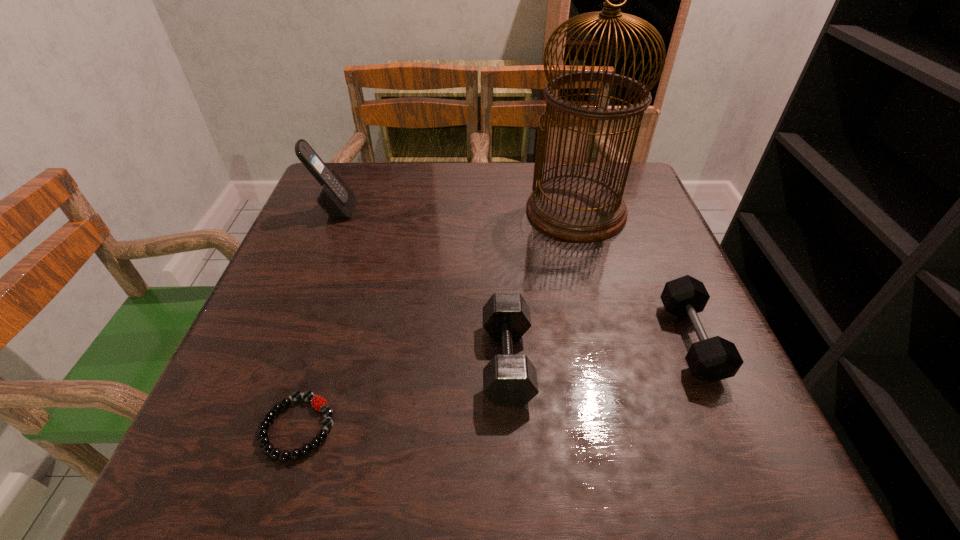
Locate an element on the screen. The image size is (960, 540). free point between the right dumbbell and the third object from right to left is located at coordinates (599, 351).

Identify the location of free space between the tallest object and the right dumbbell. [634, 275].

Where is `free space between the right dumbbell and the cellular telephone`? This screenshot has height=540, width=960. free space between the right dumbbell and the cellular telephone is located at coordinates (513, 275).

You are a GUI agent. You are given a task and a screenshot of the screen. Output one action in this format:
    pyautogui.click(x=<x>, y=<y>)
    Task: Click on the unoccupied area between the right dumbbell and the left dumbbell
    The image size is (960, 540).
    Given the screenshot: What is the action you would take?
    pyautogui.click(x=599, y=351)

Select which object appears as the second closest to the right dumbbell. Please provide its 2D coordinates. Your answer should be formatted as a tuple, i.e. [(x, y)], where the tuple contains the x and y coordinates of a point satisfying the conditions above.

[(509, 379)]

The width and height of the screenshot is (960, 540). In order to click on object identified as the closest to the second tallest object in this screenshot , I will do [578, 207].

The image size is (960, 540). Identify the location of free space that satisfies the following two spatial constraints: 1. on the front-facing side of the cellular telephone; 2. on the right side of the right dumbbell. (282, 340).

At what (x,y) coordinates should I click in order to perform the action: click on vacant region that satisfies the following two spatial constraints: 1. on the back side of the left dumbbell; 2. on the front-facing side of the fourth shortest object. Please return your answer as a coordinate pair (x, y). The image size is (960, 540). Looking at the image, I should click on (499, 210).

Where is `free space that satisfies the following two spatial constraints: 1. on the front-facing side of the third object from right to left; 2. on the left side of the cellular telephone`? free space that satisfies the following two spatial constraints: 1. on the front-facing side of the third object from right to left; 2. on the left side of the cellular telephone is located at coordinates (274, 361).

The image size is (960, 540). In order to click on vacant point that satisfies the following two spatial constraints: 1. on the front-facing side of the left dumbbell; 2. on the left side of the cellular telephone in this screenshot , I will do `click(274, 361)`.